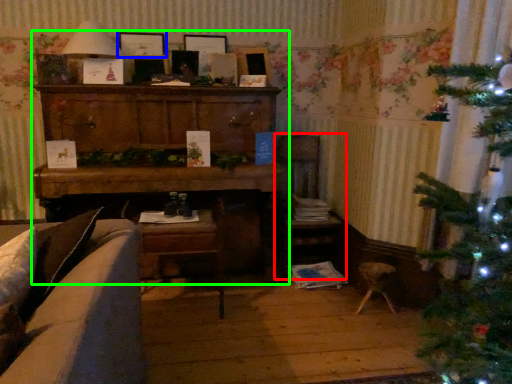
Question: Which object is positioned closest to armchair (highlighted by a red box)? Select from picture frame (highlighted by a blue box) and entertainment center (highlighted by a green box).

Choices:
 (A) picture frame
 (B) entertainment center

Answer: (B)